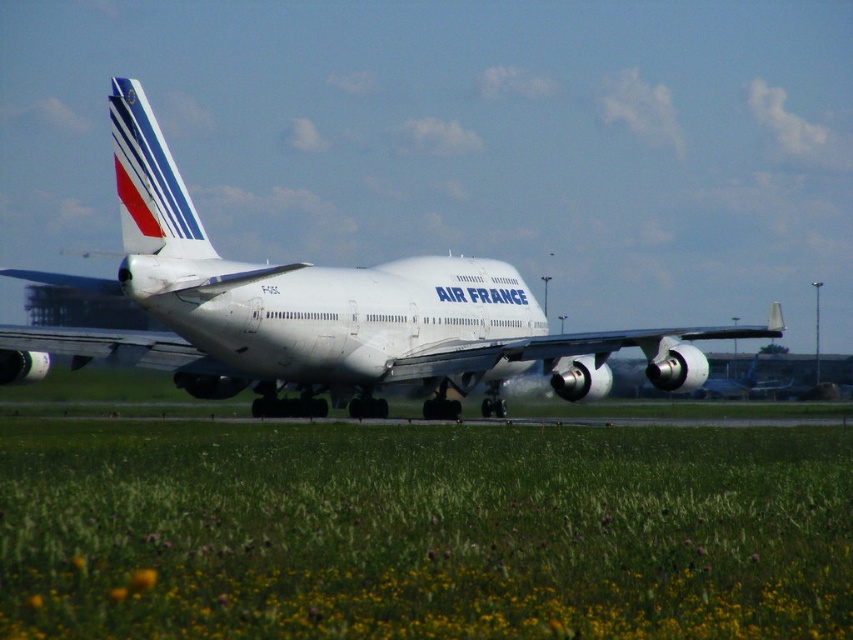
Who is positioned more to the left, green grass at center or white glossy airplane at center?

green grass at center

Which is in front, point (788, 492) or point (279, 298)?

Point (788, 492)

The image size is (853, 640). Identify the location of green grass at center. (424, 531).